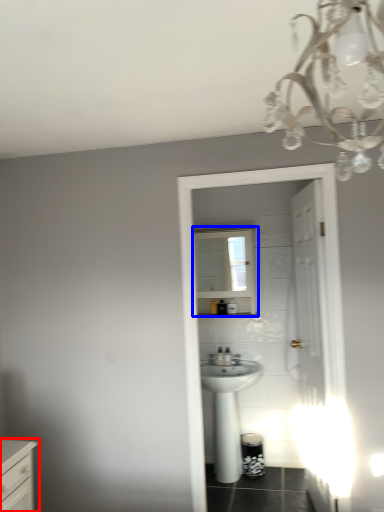
Question: Among these objects, which one is farthest to the camera, chest of drawers (highlighted by a red box) or medicine cabinet (highlighted by a blue box)?

Choices:
 (A) chest of drawers
 (B) medicine cabinet

Answer: (B)